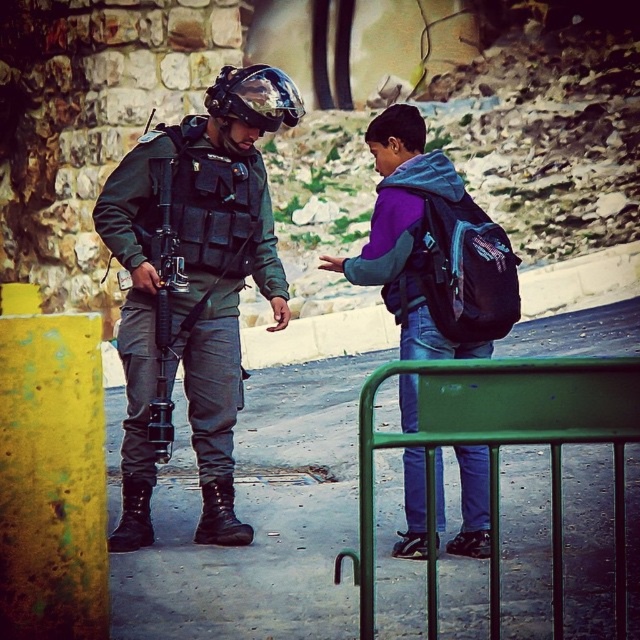
Question: Which point is closer to the camera taking this photo?

Choices:
 (A) (464, 284)
 (B) (410, 388)
 (C) (616, 417)

Answer: (C)

Question: Is matte black backpack at center right bigger than matte black helmet at center?

Choices:
 (A) yes
 (B) no

Answer: (A)

Question: From the image, what is the correct spatial relationship of green metal barricade at center in relation to matte black backpack at center right?

Choices:
 (A) left
 (B) right

Answer: (A)

Question: Which is farther from the matte black uniform at center?

Choices:
 (A) purple fleece jacket at center
 (B) green metal barricade at center
 (C) matte black helmet at center

Answer: (B)

Question: Which of the following is the farthest from the observer?

Choices:
 (A) (253, 118)
 (B) (168, 276)
 (C) (419, 340)
 (D) (452, 262)

Answer: (A)

Question: Is green metal barricade at center below matte black helmet at center?

Choices:
 (A) yes
 (B) no

Answer: (A)